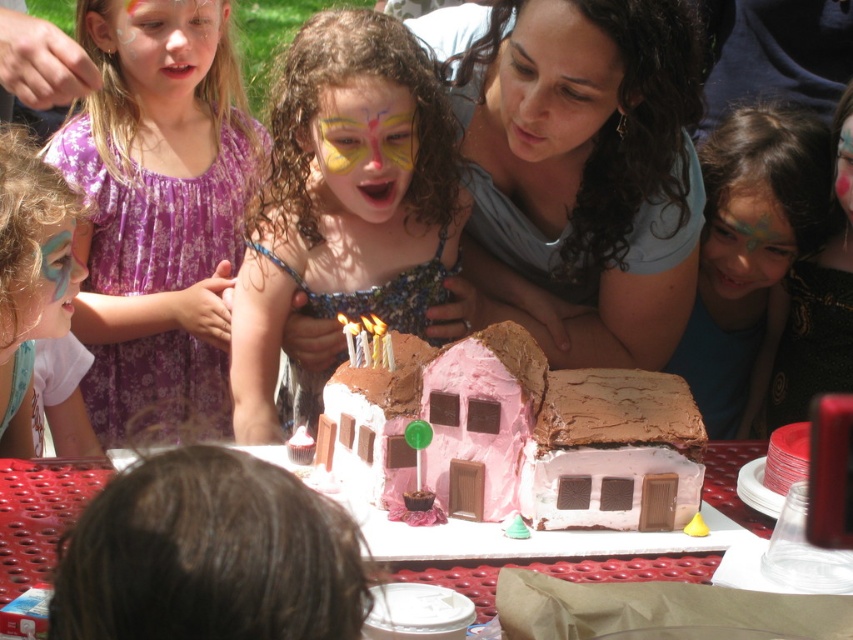
Who is shorter, matte purple dress at left or matte pink dress at center?

matte pink dress at center is shorter.

Which is above, matte purple dress at left or matte pink dress at center?

matte purple dress at left

Who is more forward, (138, 168) or (334, 240)?

Point (334, 240) is more forward.

Where is `matte purple dress at left`? matte purple dress at left is located at coordinates (160, 212).

Between matte purple dress at left and matte blue face paint at lower left, which one appears on the right side from the viewer's perspective?

A: matte purple dress at left is more to the right.

Who is more distant from viewer, (99, 49) or (32, 250)?

The point (99, 49) is more distant.

Between point (132, 442) and point (16, 362), which one is positioned in front?

Point (16, 362)

Locate an element on the screen. matte purple dress at left is located at coordinates (160, 212).

Can you confirm if pastel butterfly face paint at center is smaller than pastel blue face paint at center?

No.

Locate an element on the screen. The height and width of the screenshot is (640, 853). pastel butterfly face paint at center is located at coordinates (364, 147).

What do you see at coordinates (364, 147) in the screenshot? This screenshot has width=853, height=640. I see `pastel butterfly face paint at center` at bounding box center [364, 147].

Locate an element on the screen. This screenshot has width=853, height=640. pastel butterfly face paint at center is located at coordinates (364, 147).